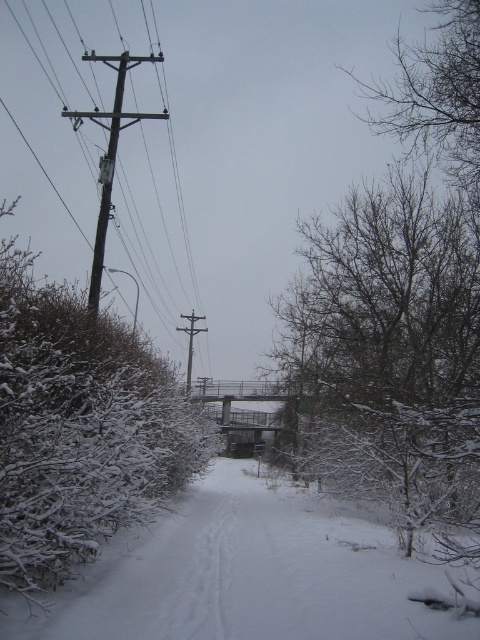
Question: Does brown wooden pole at left have a lesser width compared to metallic gray telegraph pole at center?

Choices:
 (A) yes
 (B) no

Answer: (B)

Question: Which of the following is the farthest from the observer?

Choices:
 (A) tap(348, 205)
 (B) tap(94, 596)

Answer: (A)

Question: Among these points, which one is farthest from the camera?

Choices:
 (A) (184, 328)
 (B) (112, 163)

Answer: (A)

Question: Observing the image, what is the correct spatial positioning of brown wooden pole at left in reference to metallic gray telegraph pole at center?

Choices:
 (A) above
 (B) below

Answer: (A)

Question: From the image, what is the correct spatial relationship of bare branches at center in relation to brown wooden pole at left?

Choices:
 (A) right
 (B) left

Answer: (A)

Question: Which point is farther to the camera?

Choices:
 (A) (191, 374)
 (B) (372, 618)
 (C) (11, 512)

Answer: (A)